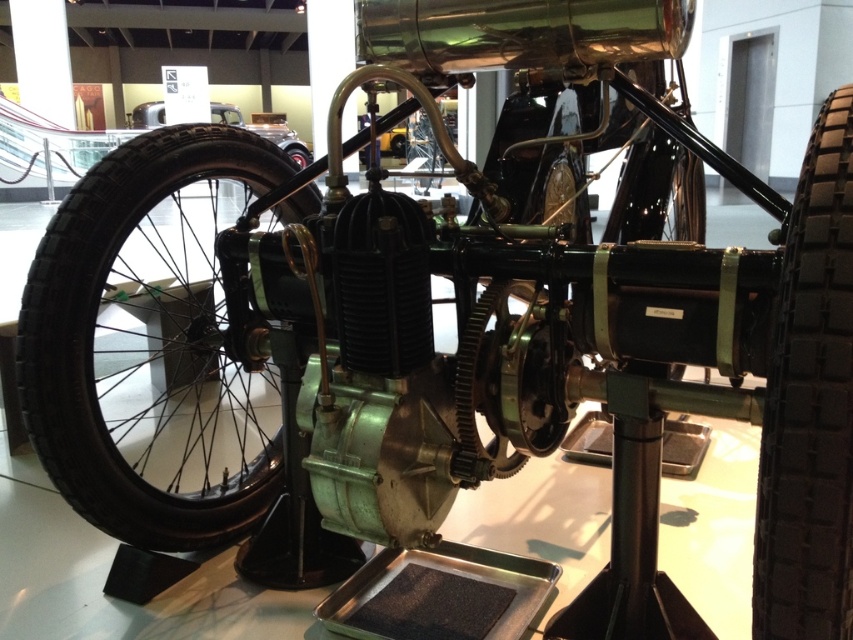
Question: Which of the following is the farthest from the observer?

Choices:
 (A) black rubber tire at left
 (B) black rubber tire at right

Answer: (A)

Question: Does black rubber tire at left have a lesser width compared to black rubber tire at right?

Choices:
 (A) no
 (B) yes

Answer: (A)

Question: Is black rubber tire at left to the left of black rubber tire at right from the viewer's perspective?

Choices:
 (A) no
 (B) yes

Answer: (B)

Question: Which point is farther from the camera taking this photo?

Choices:
 (A) (776, 548)
 (B) (155, 228)

Answer: (B)

Question: Where is black rubber tire at left located in relation to black rubber tire at right in the image?

Choices:
 (A) above
 (B) below

Answer: (B)